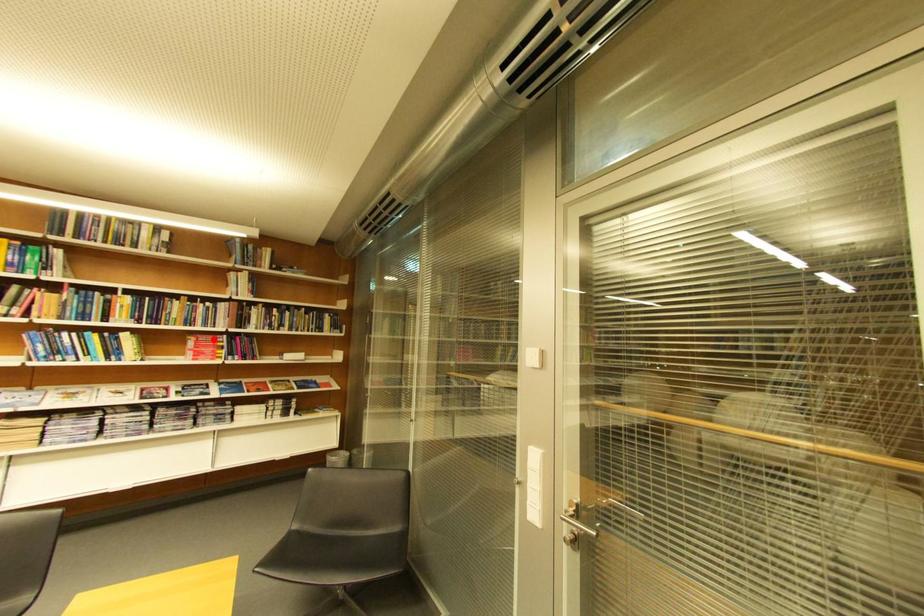
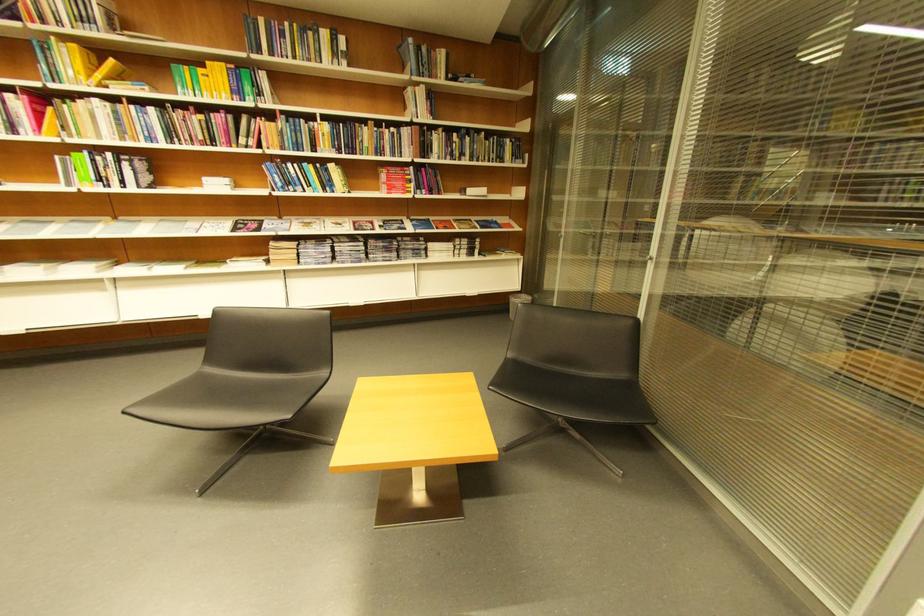
The point at the highlighted location is marked in the first image. Where is the corresponding point in the second image?

(403, 172)